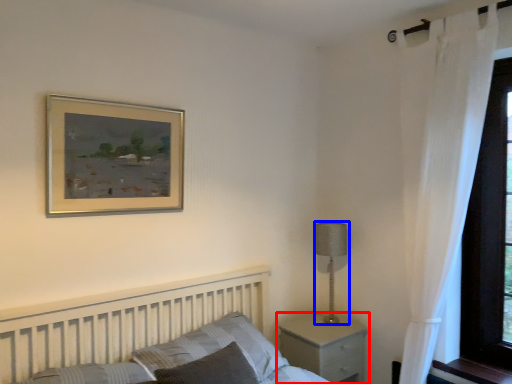
Question: Which object is closer to the camera taking this photo, nightstand (highlighted by a red box) or table lamp (highlighted by a blue box)?

Choices:
 (A) nightstand
 (B) table lamp

Answer: (A)